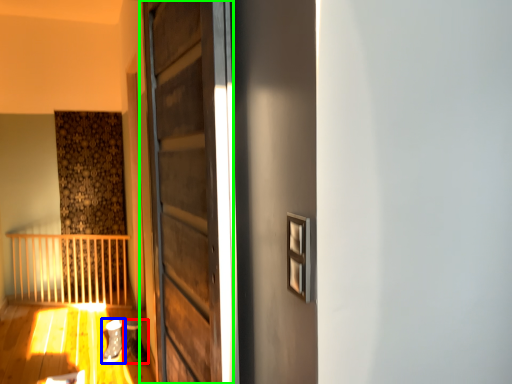
Question: Which is nearer to the shoe (highlighted by a red box)? shoe (highlighted by a blue box) or door (highlighted by a green box).

Choices:
 (A) shoe
 (B) door

Answer: (A)